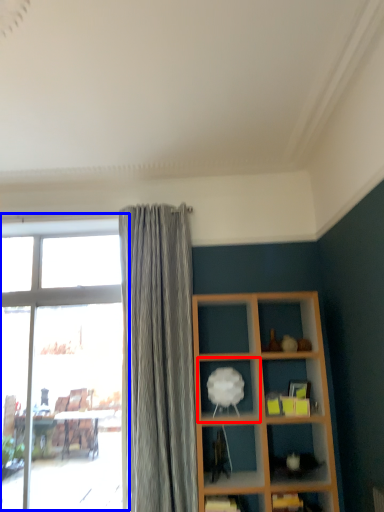
Question: Which of the following is the closest to the observer, shelf (highlighted by a red box) or window (highlighted by a blue box)?

Choices:
 (A) shelf
 (B) window

Answer: (A)